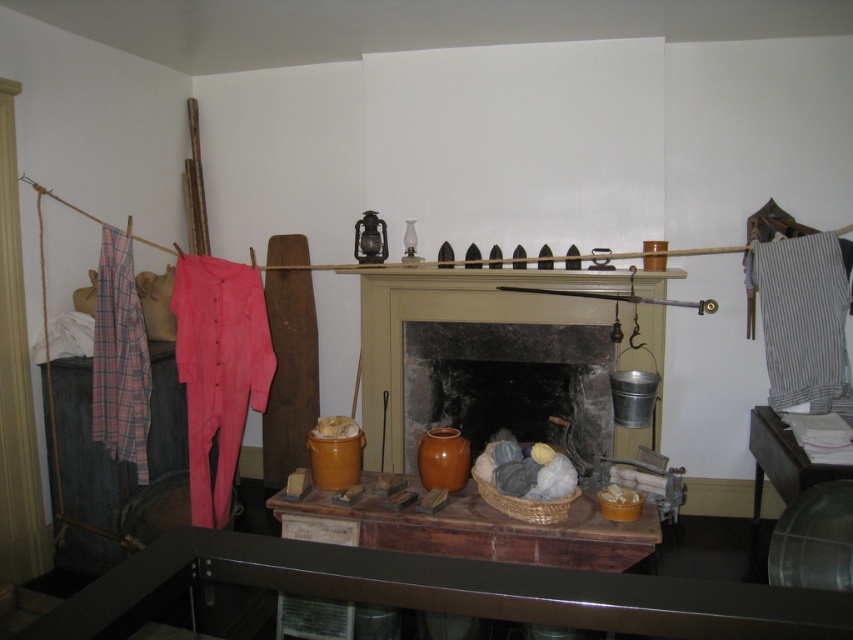
Question: Based on their relative distances, which object is nearer to the plaid cotton pants at left?

Choices:
 (A) gray striped fabric at right
 (B) pink cotton overalls at left
 (C) dark gray stone fireplace at center
 (D) white paper at lower right

Answer: (B)

Question: Where is dark gray stone fireplace at center located in relation to pink cotton overalls at left in the image?

Choices:
 (A) left
 (B) right

Answer: (B)

Question: Which point is farther to the camera?

Choices:
 (A) pink cotton overalls at left
 (B) white paper at lower right
 (C) plaid cotton pants at left

Answer: (A)

Question: Which point is closer to the camera?

Choices:
 (A) dark gray stone fireplace at center
 (B) plaid cotton pants at left

Answer: (B)

Question: Can you confirm if pink cotton overalls at left is positioned below gray striped fabric at right?

Choices:
 (A) no
 (B) yes

Answer: (B)

Question: From the image, what is the correct spatial relationship of dark gray stone fireplace at center in relation to white paper at lower right?

Choices:
 (A) right
 (B) left

Answer: (B)